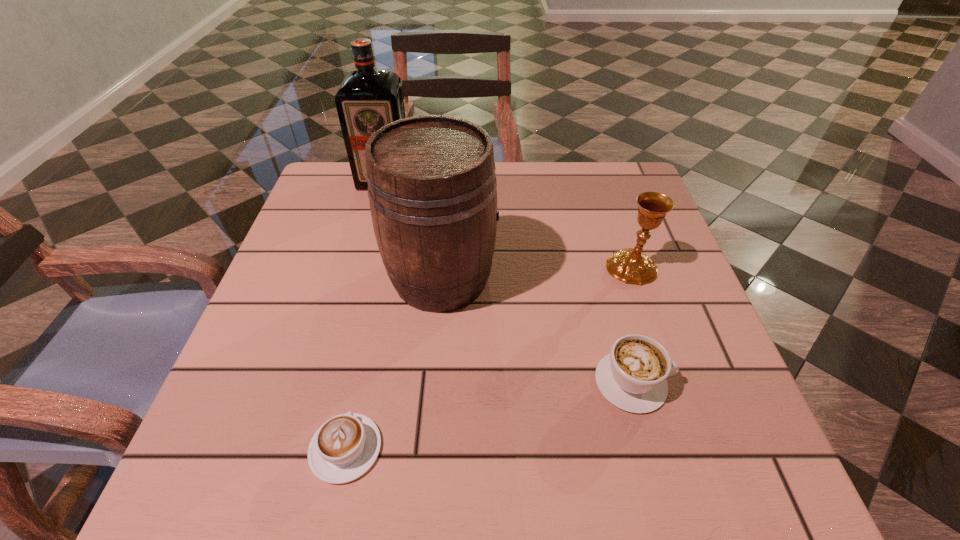
The image size is (960, 540). I want to click on free space between the cider and the right cappuccino, so click(x=537, y=330).

Find the location of a particular element. Image resolution: width=960 pixels, height=540 pixels. free spot between the fourth farthest object and the cider is located at coordinates (537, 330).

The height and width of the screenshot is (540, 960). Find the location of `free space between the third tallest object and the nearer cappuccino`. free space between the third tallest object and the nearer cappuccino is located at coordinates (489, 357).

The height and width of the screenshot is (540, 960). Identify the location of free space that is in between the liquor and the third tallest object. (509, 223).

At what (x,y) coordinates should I click in order to perform the action: click on vacant area between the farthest object and the right cappuccino. Please return your answer as a coordinate pair (x, y). Image resolution: width=960 pixels, height=540 pixels. Looking at the image, I should click on (509, 281).

You are a GUI agent. You are given a task and a screenshot of the screen. Output one action in this format:
    pyautogui.click(x=<x>, y=<y>)
    Task: Click on the empty space that is in between the nearest object and the farthest object
    
    Given the screenshot: What is the action you would take?
    pyautogui.click(x=366, y=314)

Select which object appears as the closest to the farthest object. Please provide its 2D coordinates. Your answer should be formatted as a tuple, i.e. [(x, y)], where the tuple contains the x and y coordinates of a point satisfying the conditions above.

[(432, 188)]

Where is `object that is the closest to the nearer cappuccino`? Image resolution: width=960 pixels, height=540 pixels. object that is the closest to the nearer cappuccino is located at coordinates (432, 188).